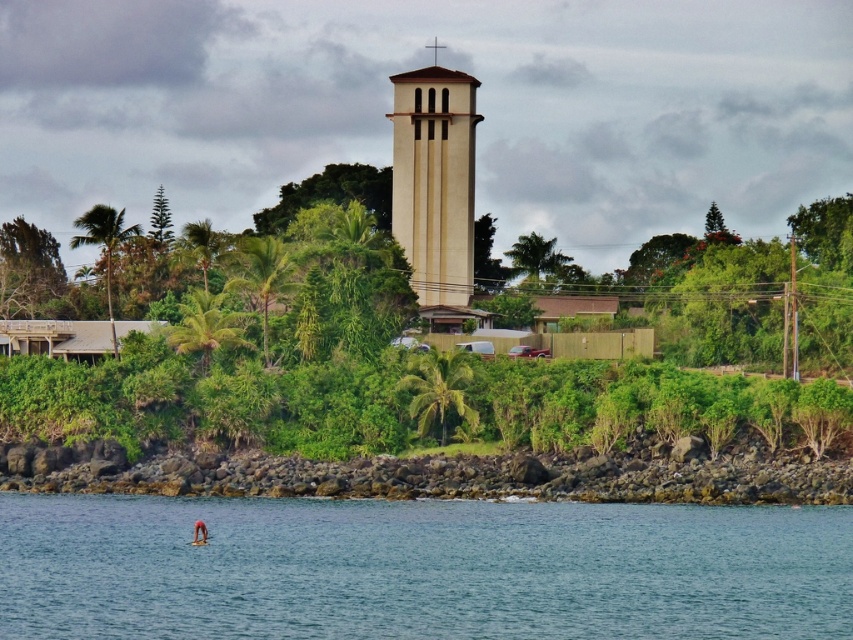
Is green leafy shrubs at center smaller than beige concrete bell tower at center?

Incorrect, green leafy shrubs at center is not smaller in size than beige concrete bell tower at center.

Is green leafy shrubs at center wider than beige concrete bell tower at center?

Correct, the width of green leafy shrubs at center exceeds that of beige concrete bell tower at center.

Image resolution: width=853 pixels, height=640 pixels. What do you see at coordinates (274, 364) in the screenshot? I see `green leafy shrubs at center` at bounding box center [274, 364].

Image resolution: width=853 pixels, height=640 pixels. I want to click on green leafy shrubs at center, so click(x=274, y=364).

Measure the distance between point (54, 486) and camera.

A distance of 106.00 meters exists between point (54, 486) and camera.

Which is more to the right, rocky shore at lower left or beige concrete bell tower at center?

Positioned to the right is beige concrete bell tower at center.

Who is more distant from viewer, [709,474] or [409,257]?

The point [409,257] is behind.

Where is `rocky shore at lower left`? rocky shore at lower left is located at coordinates (463, 477).

From the picture: Can you confirm if clear blue water at lower center is bigger than green leafy shrubs at center?

Actually, clear blue water at lower center might be smaller than green leafy shrubs at center.

Is point (590, 588) behind point (738, 412)?

No, it is in front of (738, 412).

You are a GUI agent. You are given a task and a screenshot of the screen. Output one action in this format:
    pyautogui.click(x=<x>, y=<y>)
    Task: Click on the clear blue water at lower center
    The image size is (853, 640).
    Given the screenshot: What is the action you would take?
    pyautogui.click(x=419, y=568)